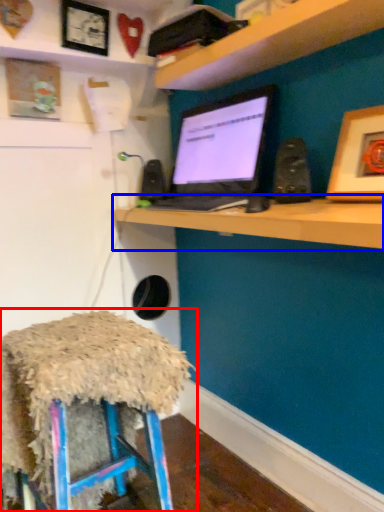
Question: Which object appears farthest to the camera in this image, stool (highlighted by a red box) or computer (highlighted by a blue box)?

Choices:
 (A) stool
 (B) computer

Answer: (A)